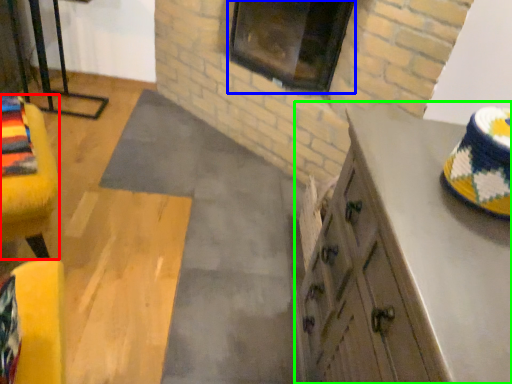
Question: Which is farther away from furniture (highlighted by a red box)? window (highlighted by a blue box) or cabinetry (highlighted by a green box)?

Choices:
 (A) window
 (B) cabinetry

Answer: (A)